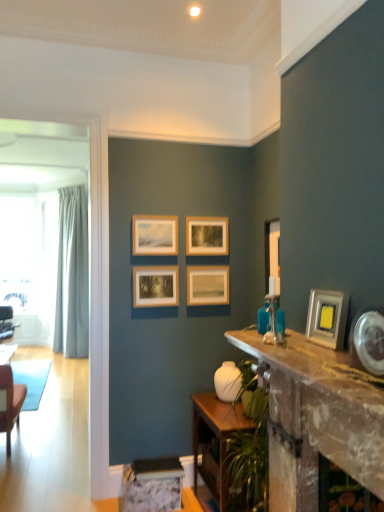
Question: Considering the positions of point click(211, 287) and point click(233, 398), is point click(211, 287) closer or farther from the camera than point click(233, 398)?

Choices:
 (A) closer
 (B) farther

Answer: (B)

Question: From a real-world perspective, is wooden picture frame at center, arranged as the second picture frame when viewed from the back, above or below white glossy vase at center?

Choices:
 (A) below
 (B) above

Answer: (B)

Question: Which of these objects is positioned closest to the rustic wooden table at center, which is the 1th table from top to bottom?

Choices:
 (A) wooden picture frame at center, which ranks as the fourth picture frame in back-to-front order
 (B) white glossy vase at center
 (C) matte black chair at left
 (D) light blue fabric curtain at left
 (E) metallic silver picture frame at right, the 6th picture frame from the back

Answer: (E)

Question: Considering the real-world distances, which object is farthest from the metallic silver picture frame at right, the 6th picture frame from the back?

Choices:
 (A) rustic wooden table at center, the 2th table positioned from the bottom
 (B) matte black chair at left
 (C) wooden table at lower center, which is the first table in bottom-to-top order
 (D) light blue fabric curtain at left
 (E) white glossy picture frame at right, acting as the 5th picture frame starting from the back

Answer: (B)